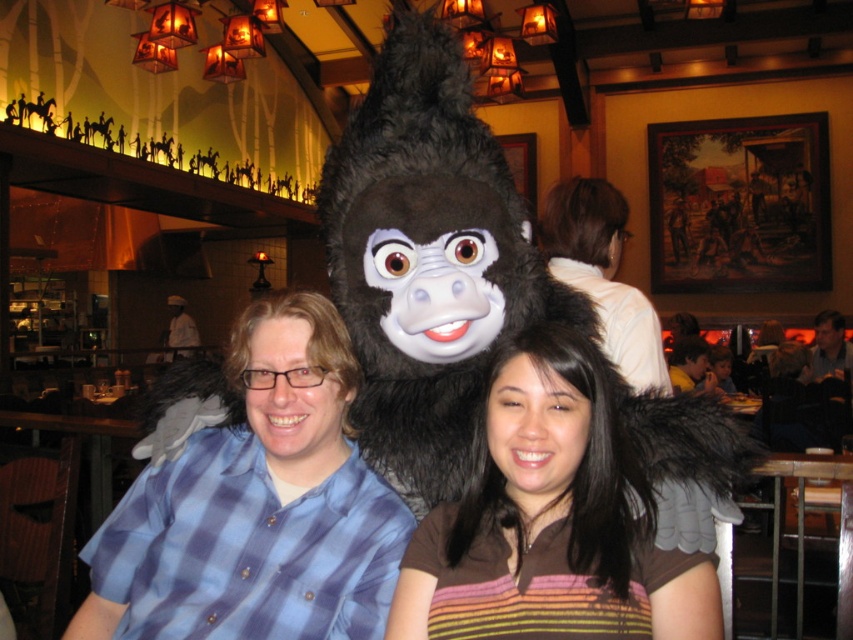
Between brown striped shirt at center and white shirt at upper center, which one has less height?

brown striped shirt at center is shorter.

Who is positioned more to the right, brown striped shirt at center or white shirt at upper center?

From the viewer's perspective, white shirt at upper center appears more on the right side.

Which is behind, point (651, 518) or point (643, 308)?

Positioned behind is point (643, 308).

Find the location of `brown striped shirt at center`. brown striped shirt at center is located at coordinates (550, 522).

Is point (305, 372) in front of point (674, 358)?

Yes, point (305, 372) is in front of point (674, 358).

Consider the image. Is blue plaid shirt at center closer to the viewer compared to smooth brown hair at center?

That is True.

The image size is (853, 640). What do you see at coordinates (256, 506) in the screenshot?
I see `blue plaid shirt at center` at bounding box center [256, 506].

I want to click on blue plaid shirt at center, so click(256, 506).

Does brown striped shirt at center have a lesser width compared to smooth brown hair at center?

Yes.

Can you confirm if brown striped shirt at center is bigger than smooth brown hair at center?

Actually, brown striped shirt at center might be smaller than smooth brown hair at center.

What do you see at coordinates (550, 522) in the screenshot? This screenshot has height=640, width=853. I see `brown striped shirt at center` at bounding box center [550, 522].

At what (x,y) coordinates should I click in order to perform the action: click on brown striped shirt at center. Please return your answer as a coordinate pair (x, y). This screenshot has height=640, width=853. Looking at the image, I should click on (550, 522).